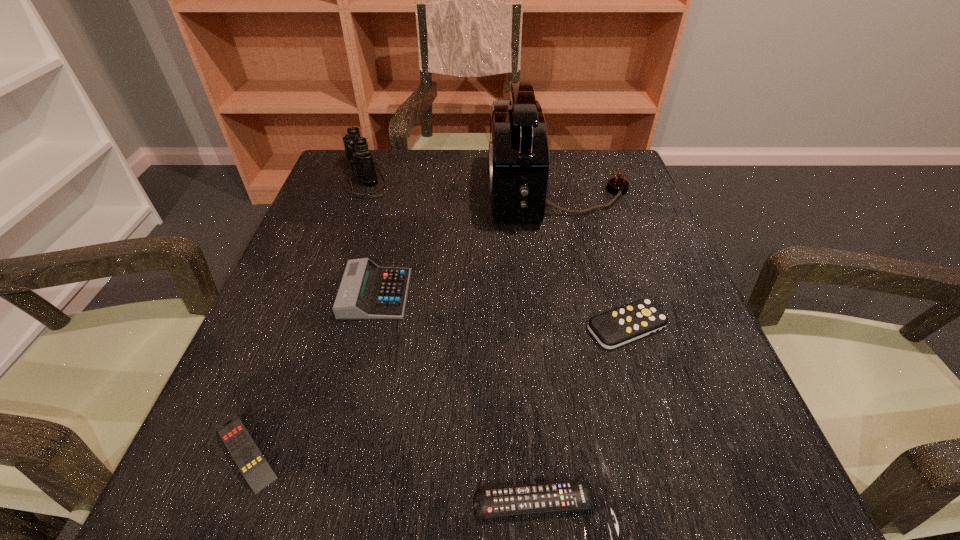
Identify which object is the closest to the leftmost remote control. Please provide its 2D coordinates. Your answer should be formatted as a tuple, i.e. [(x, y)], where the tuple contains the x and y coordinates of a point satisfying the conditions above.

[(367, 291)]

Identify which object is the second closest to the fourth tallest object. Please provide its 2D coordinates. Your answer should be formatted as a tuple, i.e. [(x, y)], where the tuple contains the x and y coordinates of a point satisfying the conditions above.

[(491, 502)]

Identify the location of the second closest remote control to the rightmost remote control. The image size is (960, 540). tap(246, 454).

Where is `the second closest remote control relative to the third shortest object`? This screenshot has width=960, height=540. the second closest remote control relative to the third shortest object is located at coordinates (246, 454).

Where is `free space that satisfies the following two spatial constraints: 1. on the back side of the rightmost remote control; 2. on the front-facing side of the radio receiver`? free space that satisfies the following two spatial constraints: 1. on the back side of the rightmost remote control; 2. on the front-facing side of the radio receiver is located at coordinates (585, 192).

The width and height of the screenshot is (960, 540). In order to click on free location that satisfies the following two spatial constraints: 1. on the front-facing side of the tallest object; 2. on the back side of the third shortest object in this screenshot , I will do `click(588, 327)`.

Identify the location of vacant space that satisfies the following two spatial constraints: 1. on the front-facing side of the radio receiver; 2. on the back side of the rightmost remote control. (588, 327).